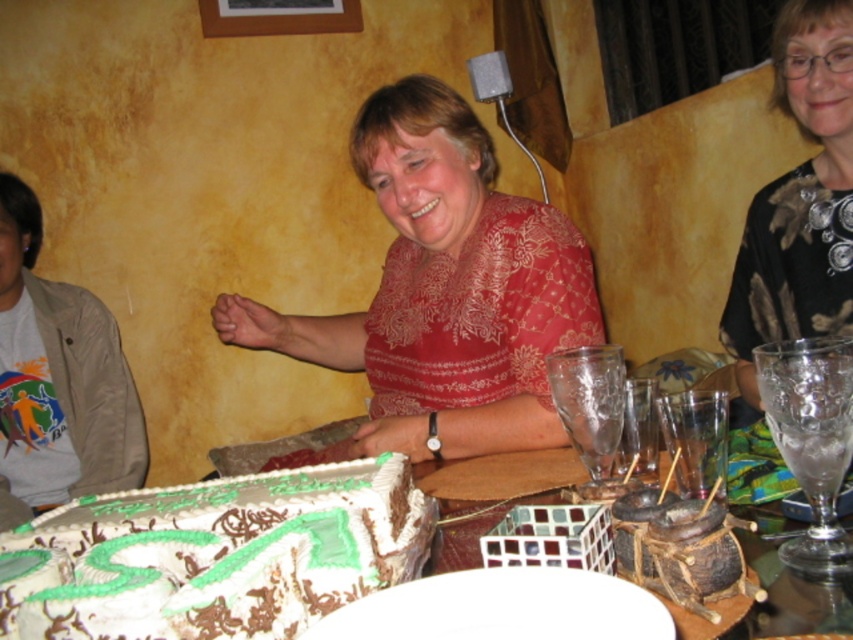
Which is more to the left, white frosted cake at center or dark brown textured chocolate cake at lower right?

Positioned to the left is white frosted cake at center.

Is white frosted cake at center bigger than dark brown textured chocolate cake at lower right?

Correct, white frosted cake at center is larger in size than dark brown textured chocolate cake at lower right.

Between point (222, 508) and point (722, 570), which one is positioned behind?

The point (222, 508) is more distant.

Locate an element on the screen. The image size is (853, 640). white frosted cake at center is located at coordinates (225, 554).

This screenshot has height=640, width=853. I want to click on white glossy cake at center, so click(x=215, y=556).

Consider the image. Is white glossy cake at center positioned in front of dark brown textured chocolate cake at lower right?

Yes, it is in front of dark brown textured chocolate cake at lower right.

Which is in front, point (224, 556) or point (650, 557)?

Point (224, 556)

The image size is (853, 640). Find the location of `white glossy cake at center`. white glossy cake at center is located at coordinates (215, 556).

Does white glossy cake at center have a lesser width compared to white frosted cake at center?

In fact, white glossy cake at center might be wider than white frosted cake at center.

Describe the element at coordinates (215, 556) in the screenshot. The image size is (853, 640). I see `white glossy cake at center` at that location.

Does point (225, 516) lie behind point (334, 486)?

No.

Locate an element on the screen. The height and width of the screenshot is (640, 853). white glossy cake at center is located at coordinates (215, 556).